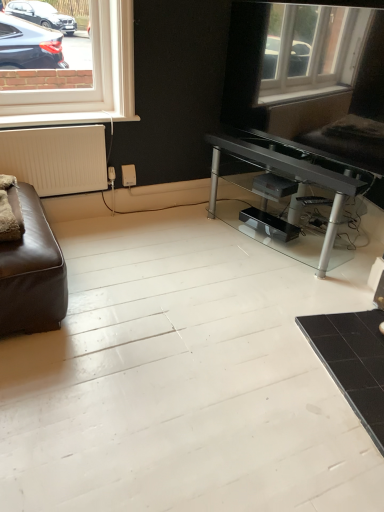
You are a GUI agent. You are given a task and a screenshot of the screen. Output one action in this format:
    pyautogui.click(x=<x>, y=<y>)
    Task: Click on the vacant space situated above white matte radiator at left (from a real-world perspective)
    This screenshot has height=512, width=384.
    Given the screenshot: What is the action you would take?
    pyautogui.click(x=57, y=122)